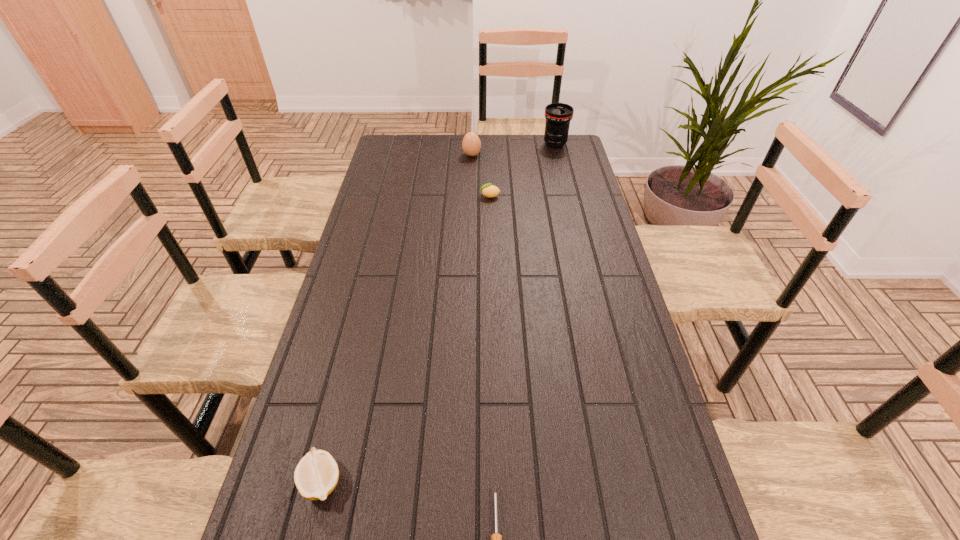
Find the location of a particular element. free space at the right edge is located at coordinates (610, 416).

Identify the location of free space between the third farthest object and the tallest object. (522, 170).

Find the location of a particular element. The width and height of the screenshot is (960, 540). empty space that is in between the boiled egg and the tallest object is located at coordinates (514, 150).

In order to click on unoccupied position between the farther lemon and the rightmost object in this screenshot , I will do `click(522, 170)`.

You are a GUI agent. You are given a task and a screenshot of the screen. Output one action in this format:
    pyautogui.click(x=<x>, y=<y>)
    Task: Click on the free space that is in between the left lemon and the tallest object
    The width and height of the screenshot is (960, 540).
    Given the screenshot: What is the action you would take?
    pyautogui.click(x=439, y=313)

You are a GUI agent. You are given a task and a screenshot of the screen. Output one action in this format:
    pyautogui.click(x=<x>, y=<y>)
    Task: Click on the free spot between the leftmost object and the boiled egg
    The width and height of the screenshot is (960, 540).
    Given the screenshot: What is the action you would take?
    pyautogui.click(x=396, y=318)

This screenshot has height=540, width=960. Identify the location of vacant space that's between the rightmost object and the farther lemon. [x=522, y=170].

At what (x,y) coordinates should I click in order to perform the action: click on vacant area that lies between the nearer lemon and the third nearest object. Please return your answer as a coordinate pair (x, y). The width and height of the screenshot is (960, 540). Looking at the image, I should click on (406, 339).

Where is `object that is the nearest to the leftmost object`? The width and height of the screenshot is (960, 540). object that is the nearest to the leftmost object is located at coordinates (496, 539).

Locate an element on the screen. Image resolution: width=960 pixels, height=540 pixels. object that is the second closest to the left lemon is located at coordinates (488, 190).